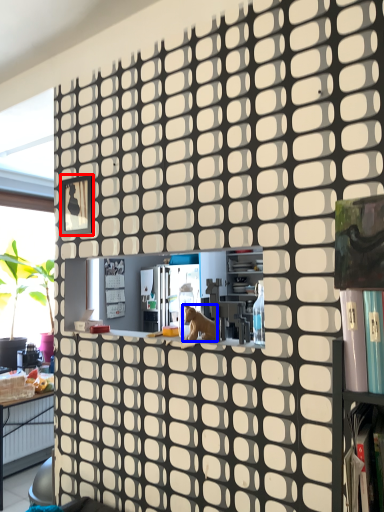
Question: Among these objects, which one is nearest to the camera, square (highlighted by a red box) or animal (highlighted by a blue box)?

Choices:
 (A) square
 (B) animal

Answer: (B)